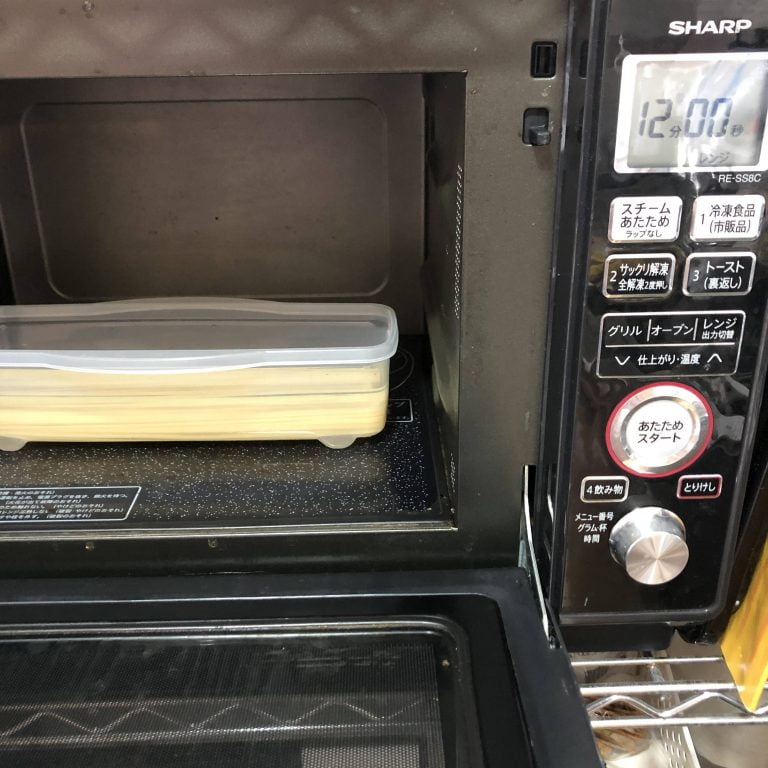
This screenshot has width=768, height=768. What are the coordinates of `wire shelf` in the screenshot? It's located at [x=694, y=725], [x=677, y=660], [x=677, y=687].